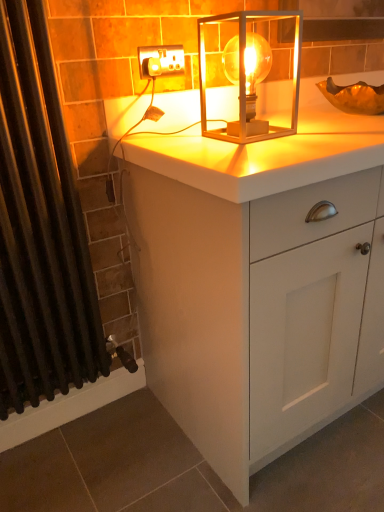
Question: Is translucent glass lamp at center facing towards black fabric shower curtain at left?

Choices:
 (A) yes
 (B) no

Answer: (B)

Question: Is translucent glass lamp at center further to the viewer compared to black fabric shower curtain at left?

Choices:
 (A) yes
 (B) no

Answer: (A)

Question: From a real-world perspective, is translucent glass lamp at center below black fabric shower curtain at left?

Choices:
 (A) no
 (B) yes

Answer: (A)

Question: Considering the relative sizes of translucent glass lamp at center and black fabric shower curtain at left in the image provided, is translucent glass lamp at center taller than black fabric shower curtain at left?

Choices:
 (A) no
 (B) yes

Answer: (A)

Question: Does translucent glass lamp at center appear on the right side of black fabric shower curtain at left?

Choices:
 (A) yes
 (B) no

Answer: (A)

Question: Can we say translucent glass lamp at center lies outside black fabric shower curtain at left?

Choices:
 (A) yes
 (B) no

Answer: (A)

Question: Is the position of black fabric shower curtain at left less distant than that of white matte cabinet at center?

Choices:
 (A) no
 (B) yes

Answer: (B)

Question: Is black fabric shower curtain at left next to white matte cabinet at center?

Choices:
 (A) yes
 (B) no

Answer: (B)

Question: Are black fabric shower curtain at left and white matte cabinet at center far apart?

Choices:
 (A) no
 (B) yes

Answer: (A)

Question: Is black fabric shower curtain at left at the left side of white matte cabinet at center?

Choices:
 (A) yes
 (B) no

Answer: (A)

Question: Is black fabric shower curtain at left wider than white matte cabinet at center?

Choices:
 (A) yes
 (B) no

Answer: (B)

Question: Is black fabric shower curtain at left located outside white matte cabinet at center?

Choices:
 (A) yes
 (B) no

Answer: (A)

Question: From the image's perspective, is white matte cabinet at center located beneath white plastic socket at upper center?

Choices:
 (A) yes
 (B) no

Answer: (A)